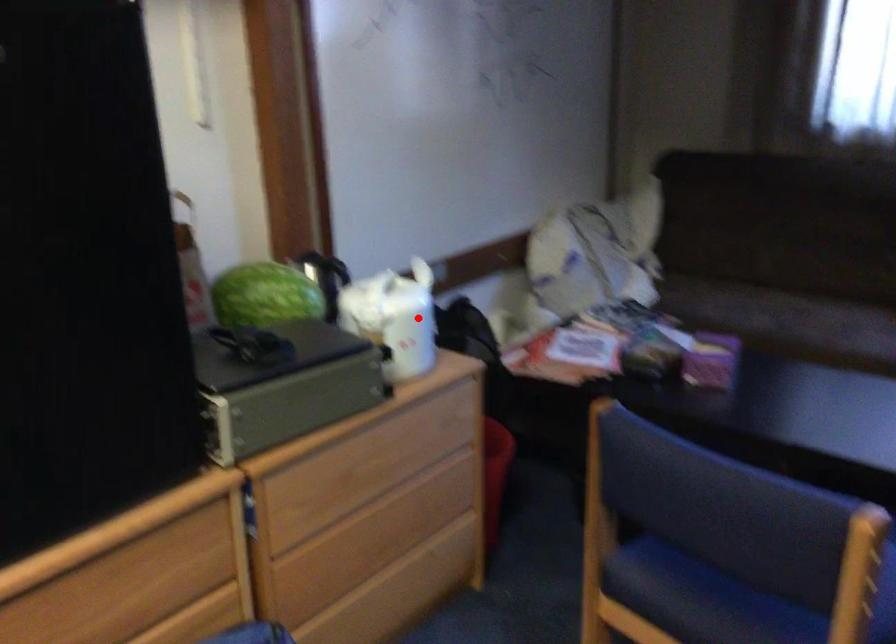
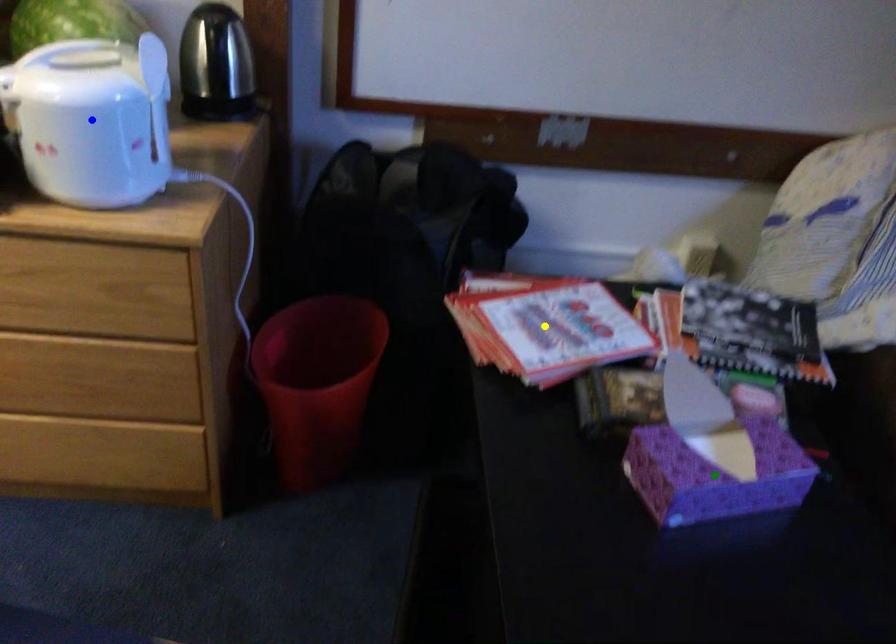
Question: I am providing you with two images of the same scene from different viewpoints. A red point is marked on the first image. You are given multiple points on the second image. Which point in image 2 is actually the same real-world point as the red point in image 1?

Choices:
 (A) yellow point
 (B) blue point
 (C) green point

Answer: (B)